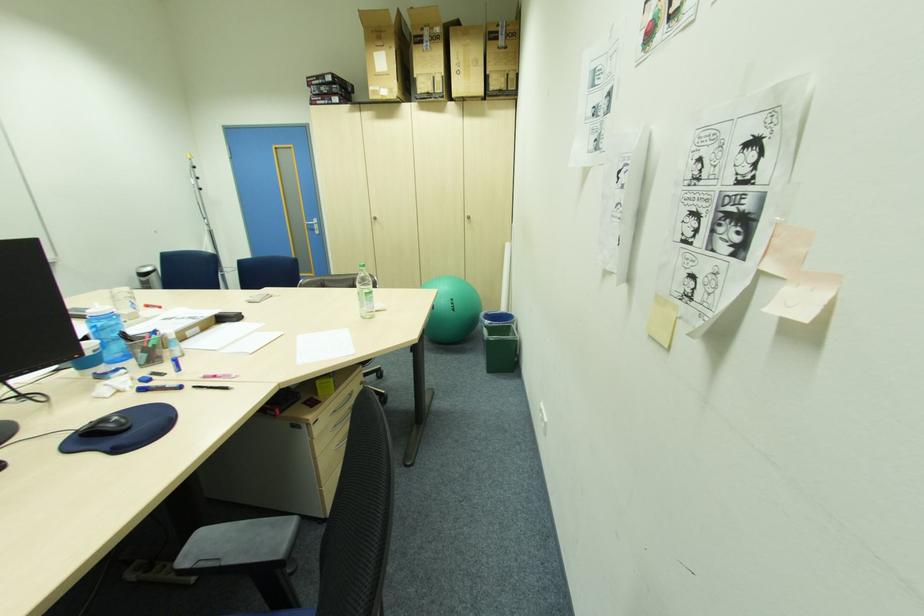
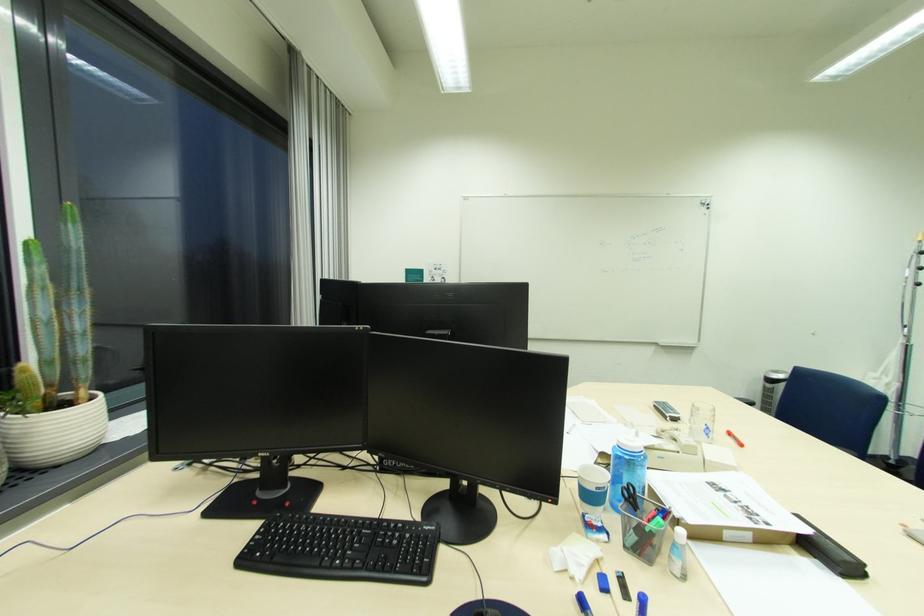
In the second image, find the point that corresponds to (152,307) in the first image.

(736, 435)